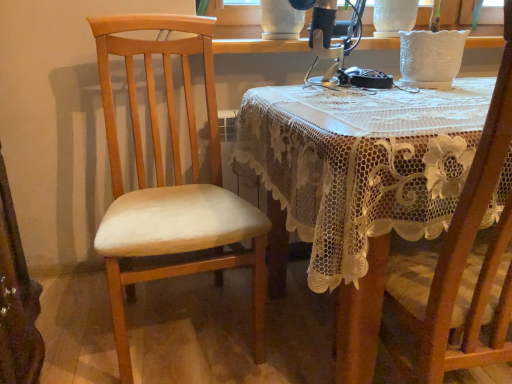
Question: Is light wood chair at left, the 1th chair viewed from the left, to the left or to the right of white textured vase at upper center in the image?

Choices:
 (A) left
 (B) right

Answer: (A)

Question: Considering the positions of light wood chair at left, the second chair viewed from the right, and white textured vase at upper center in the image, is light wood chair at left, the second chair viewed from the right, taller or shorter than white textured vase at upper center?

Choices:
 (A) short
 (B) tall

Answer: (B)

Question: Estimate the real-world distances between objects in this image. Which object is farther from the white textured vase at upper center?

Choices:
 (A) wooden chair at right, placed as the 2th chair when sorted from left to right
 (B) light wood chair at left, the second chair viewed from the right
 (C) metallic silver sewing machine at upper center
 (D) lacy fabric table at center

Answer: (A)

Question: Estimate the real-world distances between objects in this image. Which object is farther from the light wood chair at left, the 1th chair viewed from the left?

Choices:
 (A) metallic silver sewing machine at upper center
 (B) wooden chair at right, placed as the 2th chair when sorted from left to right
 (C) lacy fabric table at center
 (D) white textured vase at upper center

Answer: (D)